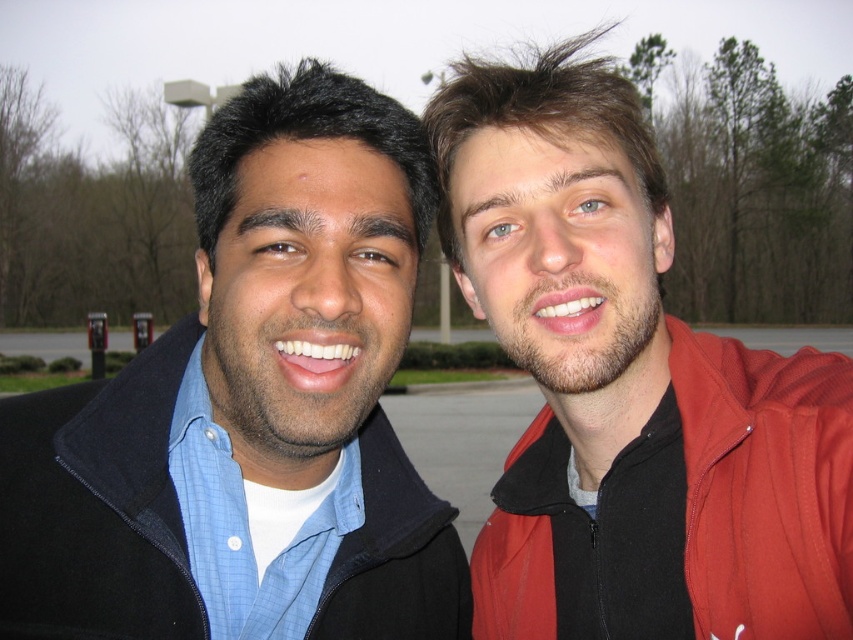
You are a photographer trying to capture both jackets in a single frame. Given that the red matte jacket at right is larger in size than the red fleece jacket at right, which jacket should you focus on to ensure both are clearly visible in the photo?

To ensure both the red matte jacket at right and the red fleece jacket at right are clearly visible in the photo, focus on the red fleece jacket at right since it is smaller and closer to the camera, allowing the larger red matte jacket at right to still fit within the frame.

You are a photographer trying to capture a photo of the two people in the scene. You need to ensure that the matte black jacket at left and the red matte jacket at right are both clearly visible in the frame. Based on their positions, which jacket is positioned closer to the left side of the photo?

The matte black jacket at left is positioned closer to the left side of the photo because it is to the left of the red matte jacket at right.

You are a photographer setting up a shot of the two people wearing the matte black jacket at left and the red matte jacket at right. You want to ensure both jackets are fully visible in the frame. Based on their widths, which jacket might require you to adjust the camera angle more to ensure it fits in the frame?

The matte black jacket at left might require adjusting the camera angle more because it is wider than the red matte jacket at right.